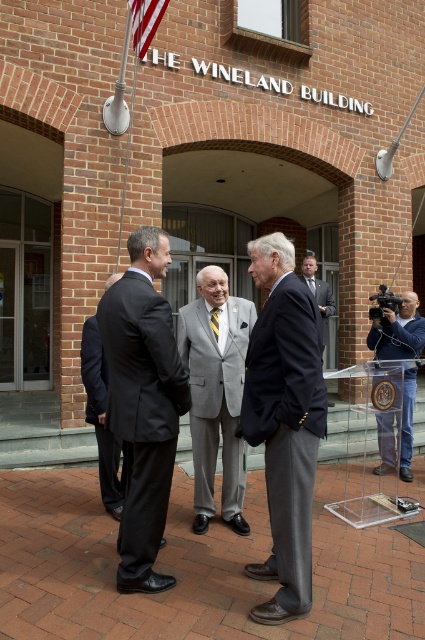
You are a photographer at the event and need to capture a photo where both the matte black suit at center and the dark blue suit at center are visible. Given their height difference, which one might appear more prominent in the photo?

The matte black suit at center is taller than the dark blue suit at center, so it will appear more prominent in the photo due to its greater height.

You are a photographer positioned at the entrance of the building. You need to take a photo that includes both the dark gray suit at center and the dark blue suit at center. Which one of them is closer to the camera so that you can focus on it first?

The dark gray suit at center is closer to the viewer than the dark blue suit at center, so you should focus on the dark gray suit at center first.